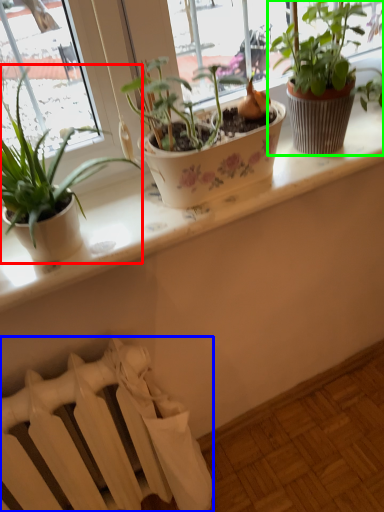
Question: Considering the real-world distances, which object is closest to houseplant (highlighted by a red box)? radiator (highlighted by a blue box) or houseplant (highlighted by a green box).

Choices:
 (A) radiator
 (B) houseplant

Answer: (B)